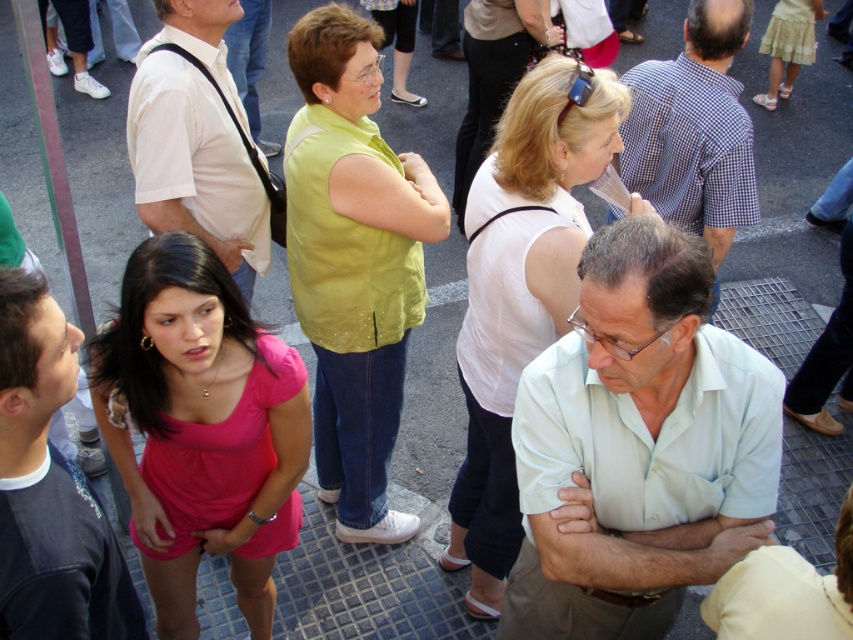
Question: Is white matte tank top at center closer to the viewer compared to blue checkered shirt at center?

Choices:
 (A) no
 (B) yes

Answer: (B)

Question: Does pink fabric dress at center have a smaller size compared to white matte shirt at upper left?

Choices:
 (A) no
 (B) yes

Answer: (A)

Question: Does matte black shirt at lower left have a lesser width compared to white matte shirt at upper left?

Choices:
 (A) no
 (B) yes

Answer: (B)

Question: Estimate the real-world distances between objects in this image. Which object is closer to the pink fabric dress at center?

Choices:
 (A) white matte shirt at upper left
 (B) light blue shirt at center

Answer: (A)

Question: Which object is the farthest from the white matte tank top at center?

Choices:
 (A) blue checkered shirt at center
 (B) pink fabric dress at center

Answer: (A)

Question: Which of the following is the farthest from the observer?

Choices:
 (A) (363, 74)
 (B) (59, 561)
 (C) (161, 493)
 (D) (693, 214)

Answer: (D)